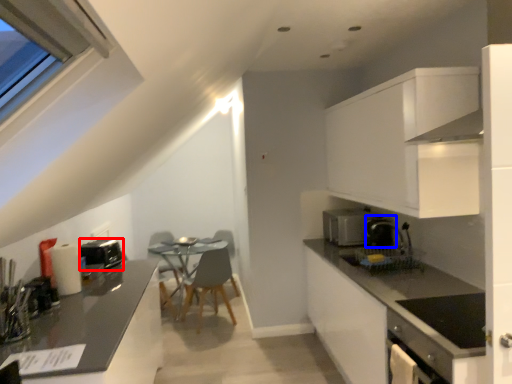
Question: Which point is closer to the camera, appliance (highlighted by a red box) or coffee machine (highlighted by a blue box)?

Choices:
 (A) appliance
 (B) coffee machine

Answer: (A)